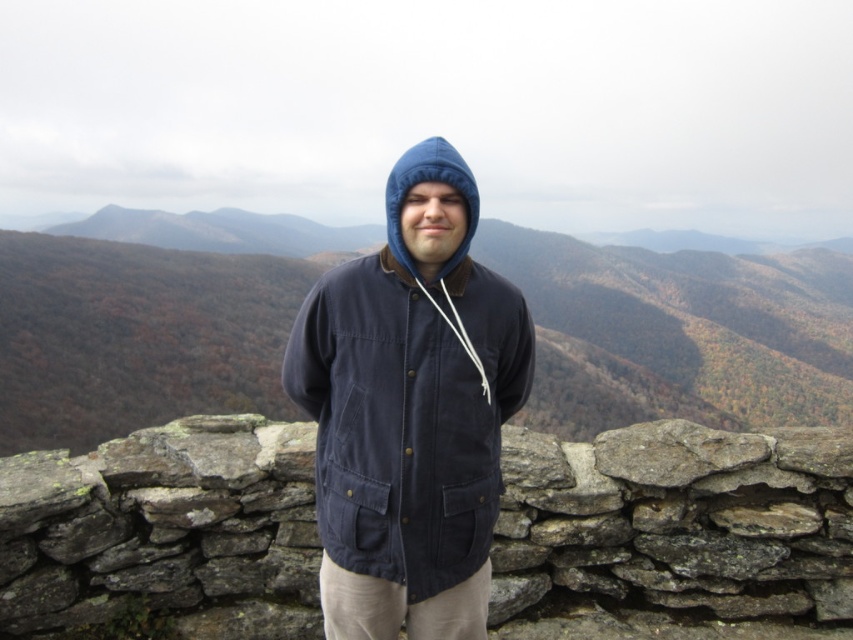
How distant is gray stone wall at center from brown textured stone wall at center?

gray stone wall at center and brown textured stone wall at center are 80.70 meters apart from each other.

Between gray stone wall at center and brown textured stone wall at center, which one appears on the right side from the viewer's perspective?

brown textured stone wall at center is more to the right.

Is point (228, 612) positioned after point (279, 312)?

No.

The width and height of the screenshot is (853, 640). Identify the location of gray stone wall at center. (677, 518).

Who is positioned more to the left, brown textured stone wall at center or navy corduroy jacket at center?

Positioned to the left is navy corduroy jacket at center.

Which is behind, point (608, 371) or point (320, 563)?

The point (608, 371) is behind.

Is point (793, 264) positioned behind point (381, 593)?

That is True.

The height and width of the screenshot is (640, 853). Identify the location of brown textured stone wall at center. (679, 332).

Describe the element at coordinates (677, 518) in the screenshot. I see `gray stone wall at center` at that location.

Can you confirm if gray stone wall at center is wider than navy corduroy jacket at center?

Correct, the width of gray stone wall at center exceeds that of navy corduroy jacket at center.

Image resolution: width=853 pixels, height=640 pixels. I want to click on gray stone wall at center, so click(677, 518).